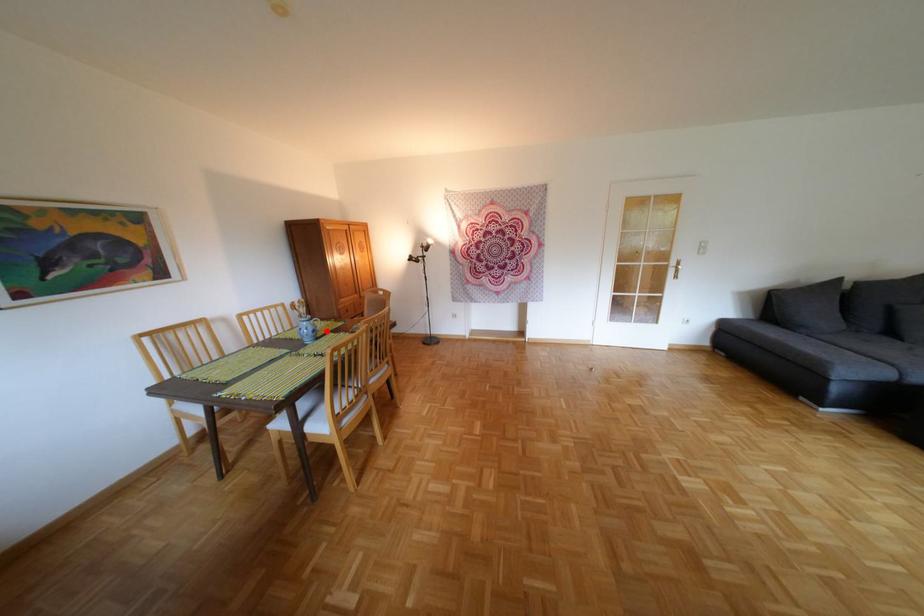
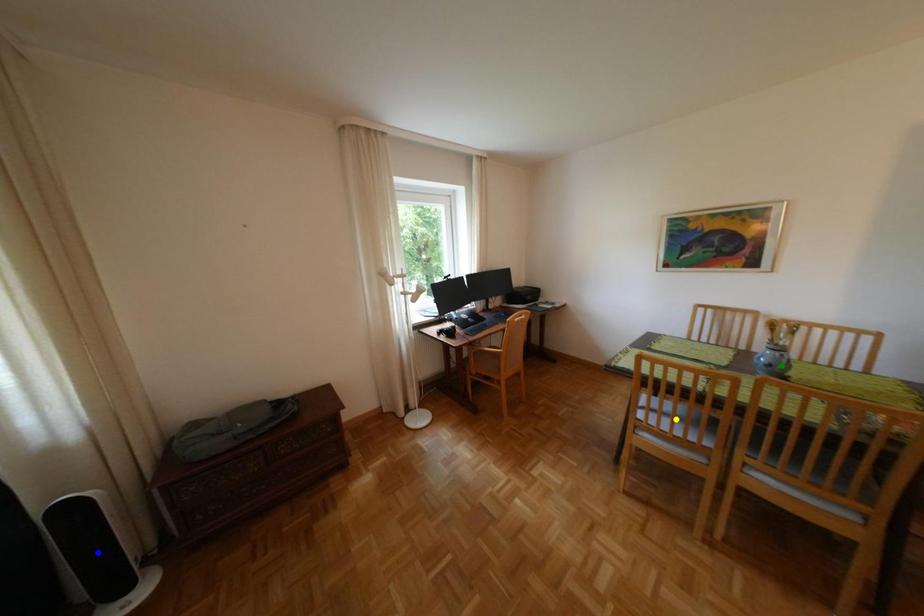
Question: I am providing you with two images of the same scene from different viewpoints. A red point is marked on the first image. You are given multiple points on the second image. Can you choose the point in image 2 that corresponds to the point in image 1?

Choices:
 (A) yellow point
 (B) green point
 (C) blue point

Answer: (B)